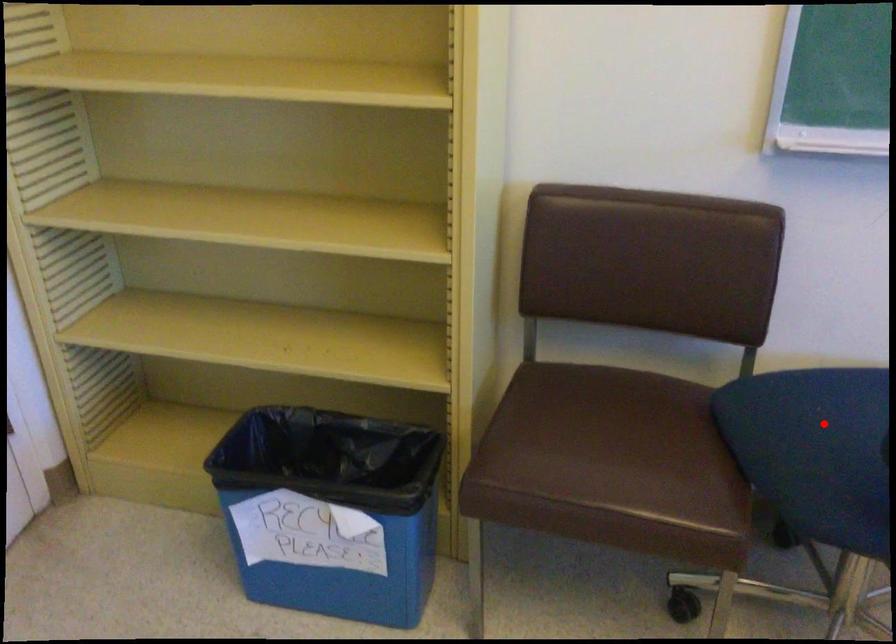
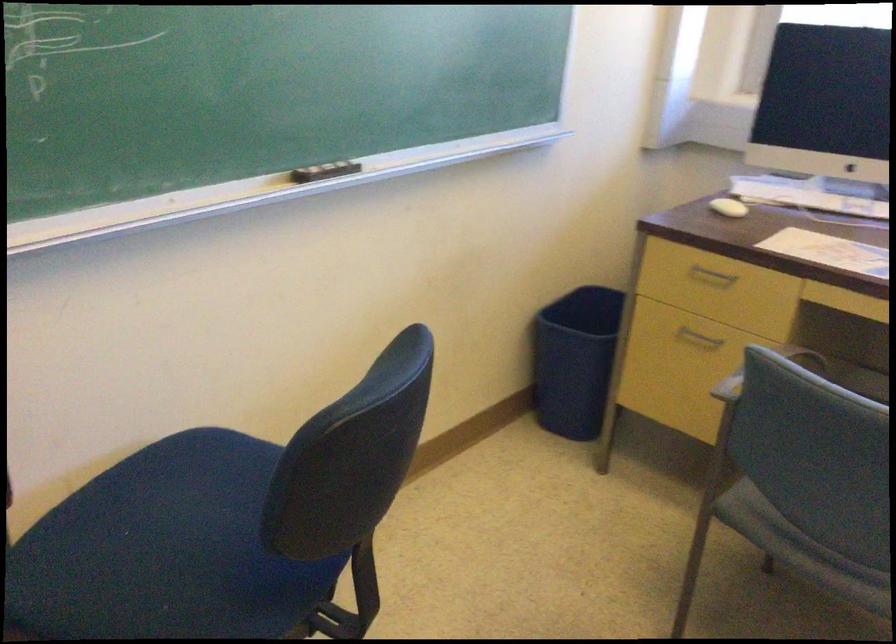
Locate, in the second image, the point that corresponds to the highlighted location in the first image.

(165, 550)